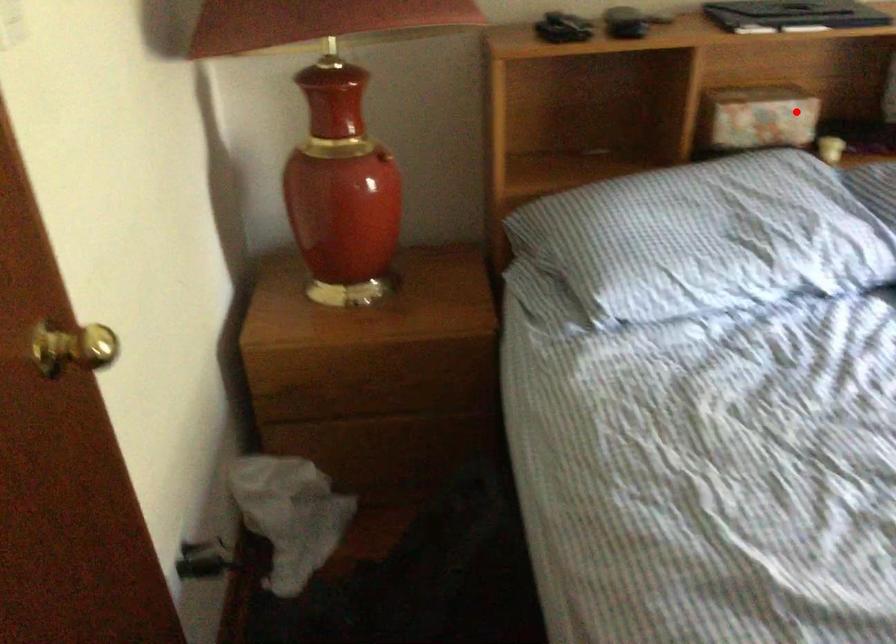
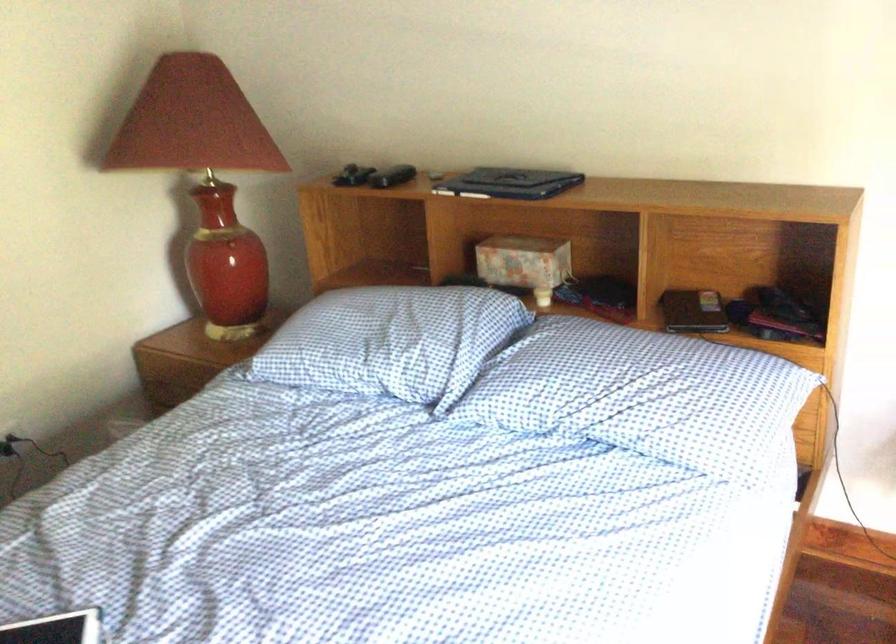
Question: I am providing you with two images of the same scene from different viewpoints. Image1 has a red point marked. In image2, the corresponding 3D location appears at what relative position? Reply with the corresponding letter.

Choices:
 (A) Closer
 (B) Farther

Answer: (B)